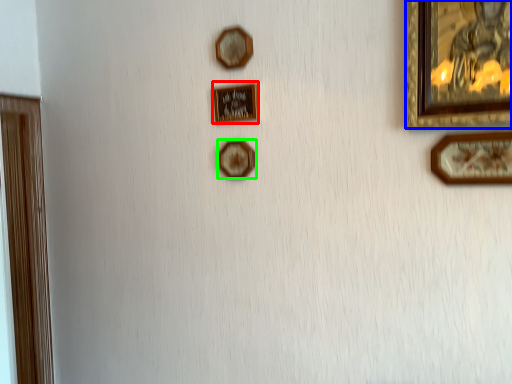
Question: Considering the real-world distances, which object is closest to picture frame (highlighted by a red box)? picture frame (highlighted by a blue box) or picture frame (highlighted by a green box).

Choices:
 (A) picture frame
 (B) picture frame

Answer: (B)